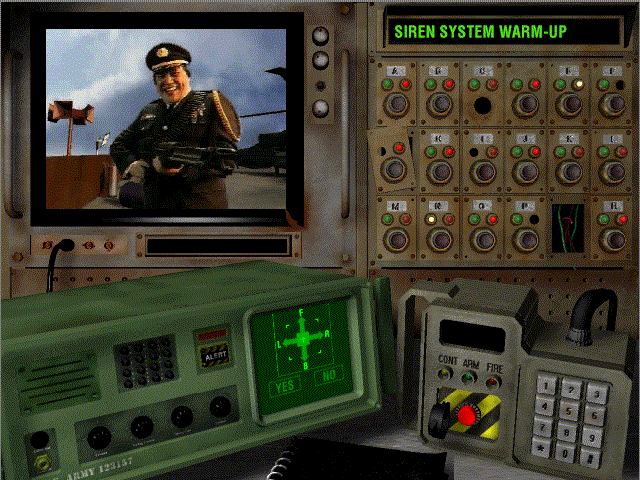
This screenshot has height=480, width=640. I want to click on tv screen, so click(x=155, y=101).